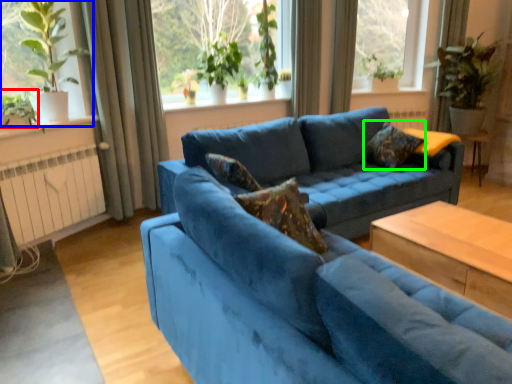
Question: Estimate the real-world distances between objects in this image. Which object is closer to plant (highlighted by a red box), window (highlighted by a blue box) or pillow (highlighted by a green box)?

Choices:
 (A) window
 (B) pillow

Answer: (A)